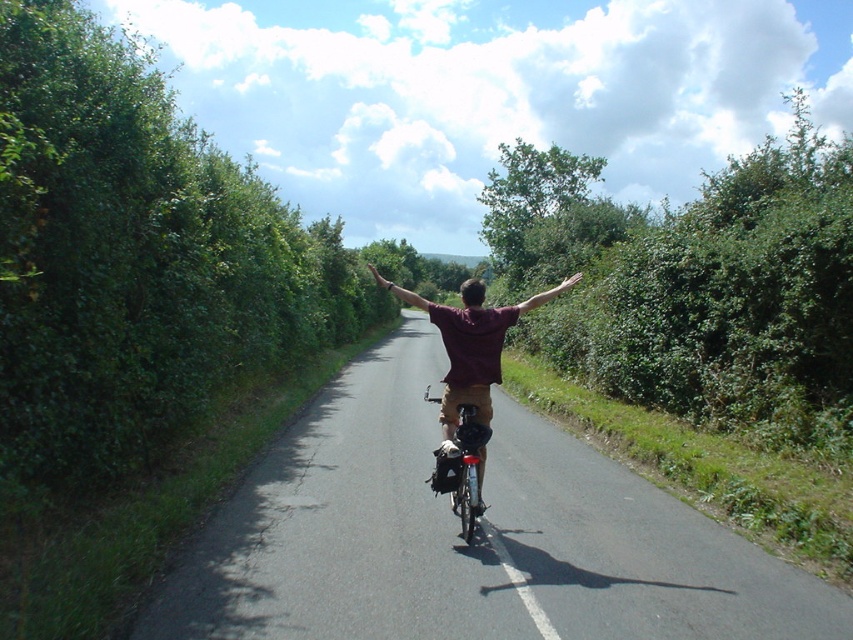
Question: Which point is farther to the camera?

Choices:
 (A) (384, 288)
 (B) (460, 403)
 (C) (566, 289)

Answer: (A)

Question: Which of the following is the closest to the observer?

Choices:
 (A) brown leather hand at center
 (B) smooth skin hand at upper center

Answer: (A)

Question: Is metallic silver bicycle at center to the right of smooth skin hand at upper center from the viewer's perspective?

Choices:
 (A) no
 (B) yes

Answer: (A)

Question: Which of the following is the farthest from the observer?

Choices:
 (A) brown leather hand at center
 (B) brown leather arm at center
 (C) smooth skin hand at upper center

Answer: (C)

Question: Is metallic silver bicycle at center to the left of brown leather hand at center from the viewer's perspective?

Choices:
 (A) no
 (B) yes

Answer: (A)

Question: Does brown fabric arm at center have a larger size compared to brown leather arm at center?

Choices:
 (A) no
 (B) yes

Answer: (A)